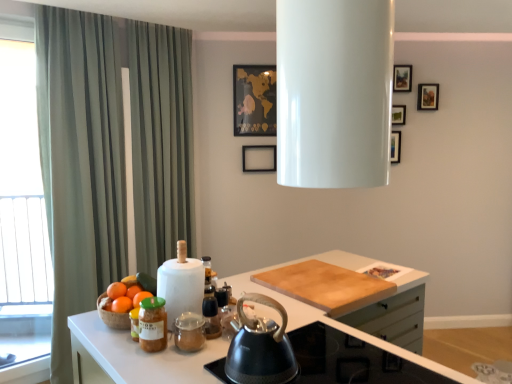
Question: In which direction should I rotate to look at gold paper map at upper center, marked as the fourth picture frame in a right-to-left arrangement?

Choices:
 (A) right
 (B) left

Answer: (A)

Question: Is black matte kettle at center at the right side of orange matte at left?

Choices:
 (A) no
 (B) yes

Answer: (B)

Question: Does black matte kettle at center have a larger size compared to orange matte at left?

Choices:
 (A) yes
 (B) no

Answer: (A)

Question: Is black matte kettle at center smaller than orange matte at left?

Choices:
 (A) yes
 (B) no

Answer: (B)

Question: Can you confirm if black matte kettle at center is thinner than orange matte at left?

Choices:
 (A) no
 (B) yes

Answer: (A)

Question: From a real-world perspective, is black matte kettle at center physically above orange matte at left?

Choices:
 (A) yes
 (B) no

Answer: (A)

Question: Could you tell me if black matte kettle at center is turned towards orange matte at left?

Choices:
 (A) yes
 (B) no

Answer: (B)

Question: Considering the relative sizes of green striped curtain at left and white sheer curtain at left in the image provided, is green striped curtain at left thinner than white sheer curtain at left?

Choices:
 (A) no
 (B) yes

Answer: (A)

Question: Does green striped curtain at left have a smaller size compared to white sheer curtain at left?

Choices:
 (A) no
 (B) yes

Answer: (A)

Question: Is green striped curtain at left aimed at white sheer curtain at left?

Choices:
 (A) no
 (B) yes

Answer: (A)

Question: Considering the relative sizes of green striped curtain at left and white sheer curtain at left in the image provided, is green striped curtain at left wider than white sheer curtain at left?

Choices:
 (A) no
 (B) yes

Answer: (B)

Question: From a real-world perspective, is green striped curtain at left on white sheer curtain at left?

Choices:
 (A) yes
 (B) no

Answer: (A)

Question: Is green striped curtain at left with white sheer curtain at left?

Choices:
 (A) yes
 (B) no

Answer: (B)

Question: Is the position of matte glass jar at lower left more distant than that of black matte picture frame at center, which is the 3th picture frame in right-to-left order?

Choices:
 (A) no
 (B) yes

Answer: (A)